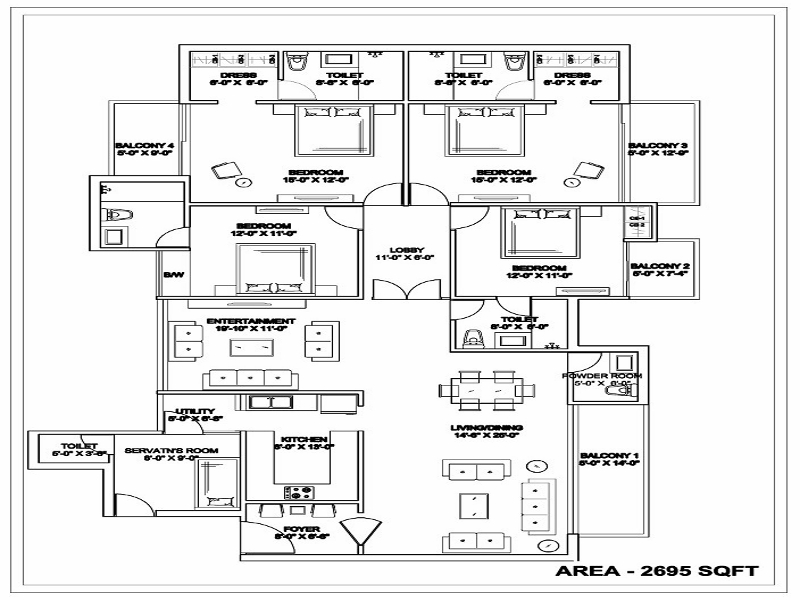
Find the location of `powder room`. powder room is located at coordinates (596, 383).